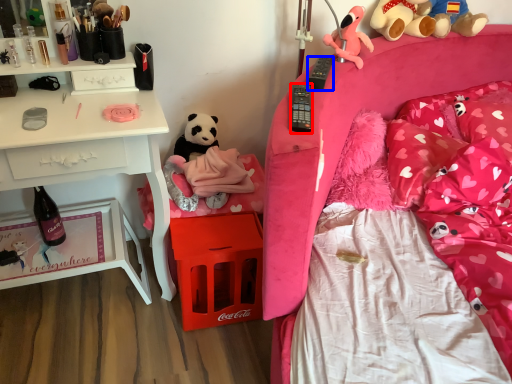
Question: Which point is further to the camera, remote control (highlighted by a red box) or remote control (highlighted by a blue box)?

Choices:
 (A) remote control
 (B) remote control

Answer: (B)